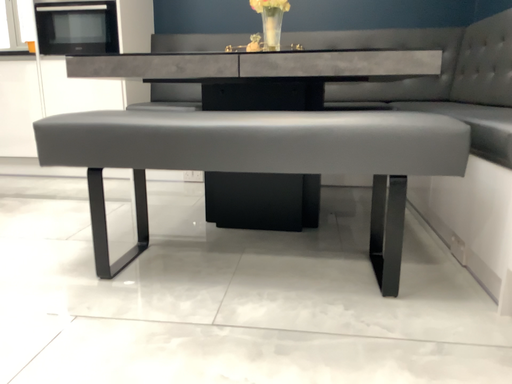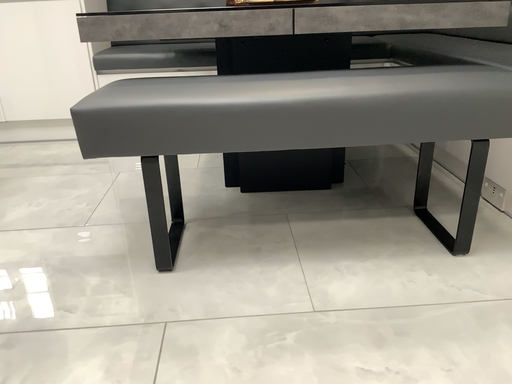
Question: How did the camera likely rotate when shooting the video?

Choices:
 (A) rotated left
 (B) rotated right

Answer: (B)